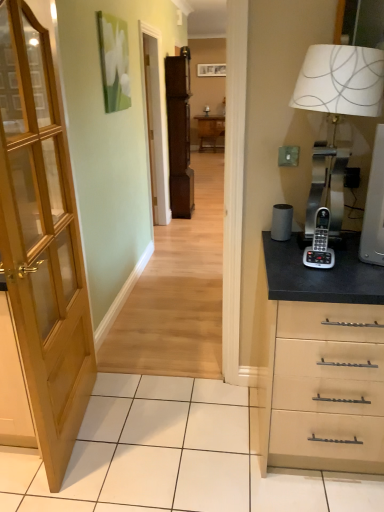
Question: Is wooden table at center oriented towards silver metallic phone at right?

Choices:
 (A) yes
 (B) no

Answer: (A)

Question: Does wooden table at center come behind silver metallic phone at right?

Choices:
 (A) yes
 (B) no

Answer: (A)

Question: Is wooden table at center in contact with silver metallic phone at right?

Choices:
 (A) no
 (B) yes

Answer: (A)

Question: Can you confirm if wooden table at center is wider than silver metallic phone at right?

Choices:
 (A) yes
 (B) no

Answer: (A)

Question: Is wooden table at center bigger than silver metallic phone at right?

Choices:
 (A) yes
 (B) no

Answer: (A)

Question: Is metallic silver table lamp at right to the left or to the right of wooden table at center in the image?

Choices:
 (A) left
 (B) right

Answer: (B)

Question: Does point (370, 84) appear closer or farther from the camera than point (223, 116)?

Choices:
 (A) closer
 (B) farther

Answer: (A)

Question: Is metallic silver table lamp at right in front of or behind wooden table at center in the image?

Choices:
 (A) behind
 (B) front

Answer: (B)

Question: From the image's perspective, is metallic silver table lamp at right above or below wooden table at center?

Choices:
 (A) above
 (B) below

Answer: (B)

Question: From the image's perspective, relative to matte wooden screen door at center, is wooden table at center above or below?

Choices:
 (A) below
 (B) above

Answer: (B)

Question: Considering their positions, is wooden table at center located in front of or behind matte wooden screen door at center?

Choices:
 (A) behind
 (B) front

Answer: (A)

Question: Would you say wooden table at center is inside or outside matte wooden screen door at center?

Choices:
 (A) inside
 (B) outside

Answer: (B)

Question: Based on their sizes in the image, would you say wooden table at center is bigger or smaller than matte wooden screen door at center?

Choices:
 (A) big
 (B) small

Answer: (B)

Question: Is silver metallic phone at right in front of or behind wooden table at center in the image?

Choices:
 (A) front
 (B) behind

Answer: (A)

Question: Visually, is silver metallic phone at right positioned to the left or to the right of wooden table at center?

Choices:
 (A) left
 (B) right

Answer: (B)